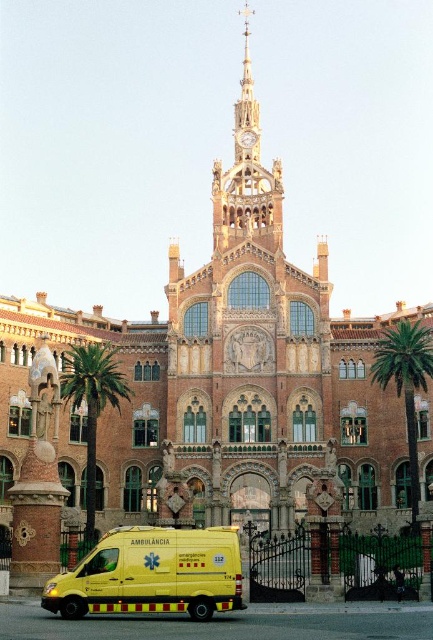
Question: Can you confirm if yellow matte ambulance at lower center is bigger than golden ornate clock tower at upper center?

Choices:
 (A) yes
 (B) no

Answer: (B)

Question: Can you confirm if golden ornate clock tower at upper center is wider than green leafy palm tree at left?

Choices:
 (A) no
 (B) yes

Answer: (B)

Question: Which point appears closest to the camera in this image?

Choices:
 (A) (417, 388)
 (B) (118, 404)
 (C) (213, 180)

Answer: (B)

Question: Which point is closer to the camera?

Choices:
 (A) green leafy palm tree at left
 (B) green leafy palm tree at right
 (C) golden ornate clock tower at upper center
 (D) yellow matte ambulance at lower center

Answer: (D)

Question: Is the position of golden ornate clock tower at upper center more distant than that of green leafy palm tree at right?

Choices:
 (A) yes
 (B) no

Answer: (A)

Question: Considering the real-world distances, which object is closest to the green leafy palm tree at right?

Choices:
 (A) green leafy palm tree at left
 (B) yellow matte ambulance at lower center
 (C) golden ornate clock tower at upper center

Answer: (C)